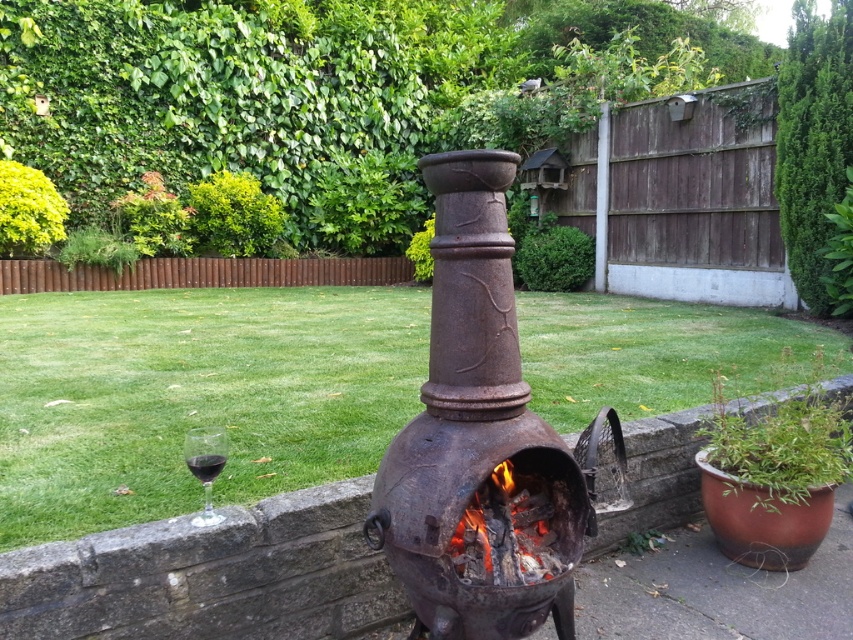
Does point (444, 320) come behind point (515, 538)?

That is True.

Describe the element at coordinates (480, 440) in the screenshot. I see `rusty cast iron fire pit at center` at that location.

Find the location of a particular element. The width and height of the screenshot is (853, 640). rusty cast iron fire pit at center is located at coordinates (480, 440).

Does rusty metal chiminea at center appear on the left side of charcoal black wood at center?

Indeed, rusty metal chiminea at center is positioned on the left side of charcoal black wood at center.

Who is positioned more to the left, rusty metal chiminea at center or charcoal black wood at center?

rusty metal chiminea at center is more to the left.

Who is more distant from viewer, (80, 428) or (525, 524)?

Point (80, 428)

Image resolution: width=853 pixels, height=640 pixels. I want to click on rusty metal chiminea at center, so pos(194,396).

The height and width of the screenshot is (640, 853). Identify the location of rusty metal chiminea at center. (194, 396).

Which of these two, rusty metal chiminea at center or rusty cast iron fire pit at center, stands shorter?

Standing shorter between the two is rusty metal chiminea at center.

The height and width of the screenshot is (640, 853). Find the location of `rusty metal chiminea at center`. rusty metal chiminea at center is located at coordinates (194, 396).